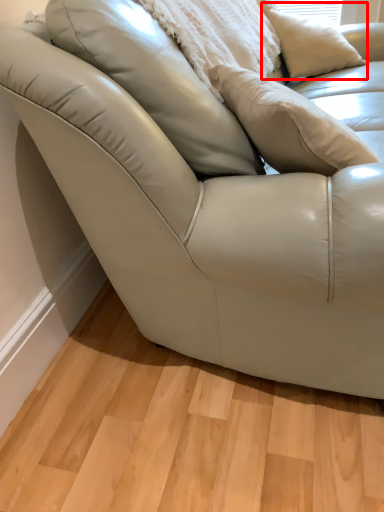
Question: From the image, what is the correct spatial relationship of pillow (annotated by the red box) in relation to pillow?

Choices:
 (A) right
 (B) left

Answer: (A)